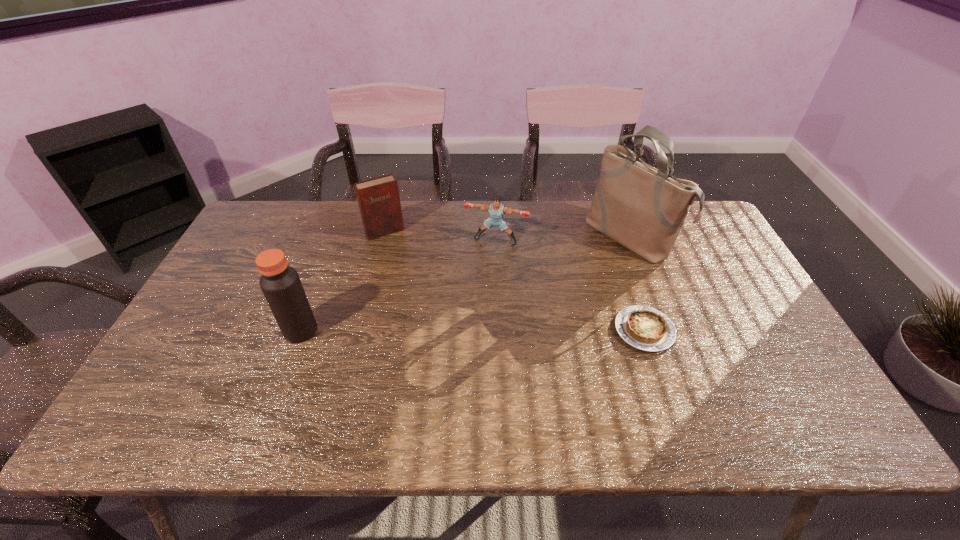
Identify the location of vacant spot on the desktop that is between the leftmost object and the quiche and is positioned on the front-facing side of the fourth tallest object. This screenshot has height=540, width=960. [464, 330].

At what (x,y) coordinates should I click in order to perform the action: click on vacant space on the desktop that is between the vinegar and the quiche and is positioned on the front cover of the diary. Please return your answer as a coordinate pair (x, y). This screenshot has width=960, height=540. Looking at the image, I should click on (443, 330).

Locate an element on the screen. This screenshot has width=960, height=540. vacant spot on the desktop that is between the vinegar and the quiche and is positioned on the front-facing side of the tallest object is located at coordinates (497, 330).